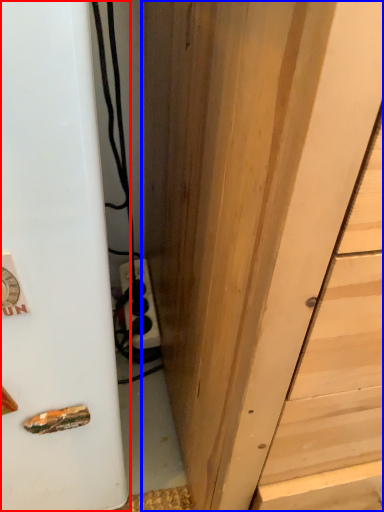
Question: Which point is further to the camera, appliance (highlighted by a red box) or door (highlighted by a blue box)?

Choices:
 (A) appliance
 (B) door

Answer: (A)